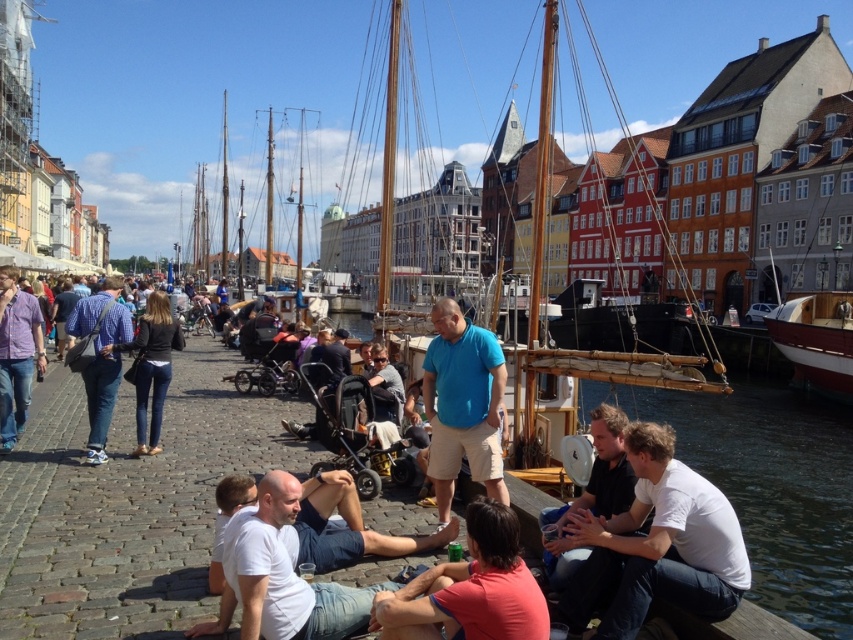
Question: Estimate the real-world distances between objects in this image. Which object is closer to the red shirt at lower center?

Choices:
 (A) denim jeans at left
 (B) blue cotton shirt at center
 (C) dark blue jeans at center

Answer: (B)

Question: Is denim jeans at lower left thinner than denim jeans at left?

Choices:
 (A) yes
 (B) no

Answer: (B)

Question: Estimate the real-world distances between objects in this image. Which object is farther from the light brown wooden chair at center?

Choices:
 (A) white cotton shirt at lower center
 (B) red shirt at lower center
 (C) denim jeans at lower left
 (D) white cotton shirt at lower right

Answer: (D)

Question: Which is farther from the light brown wooden chair at center?

Choices:
 (A) red shirt at lower center
 (B) denim jeans at lower left
 (C) white cotton shirt at lower center

Answer: (A)

Question: Is denim jeans at lower left further to the viewer compared to denim jeans at left?

Choices:
 (A) no
 (B) yes

Answer: (A)

Question: Does red shirt at lower center appear on the left side of denim jeans at lower left?

Choices:
 (A) yes
 (B) no

Answer: (B)